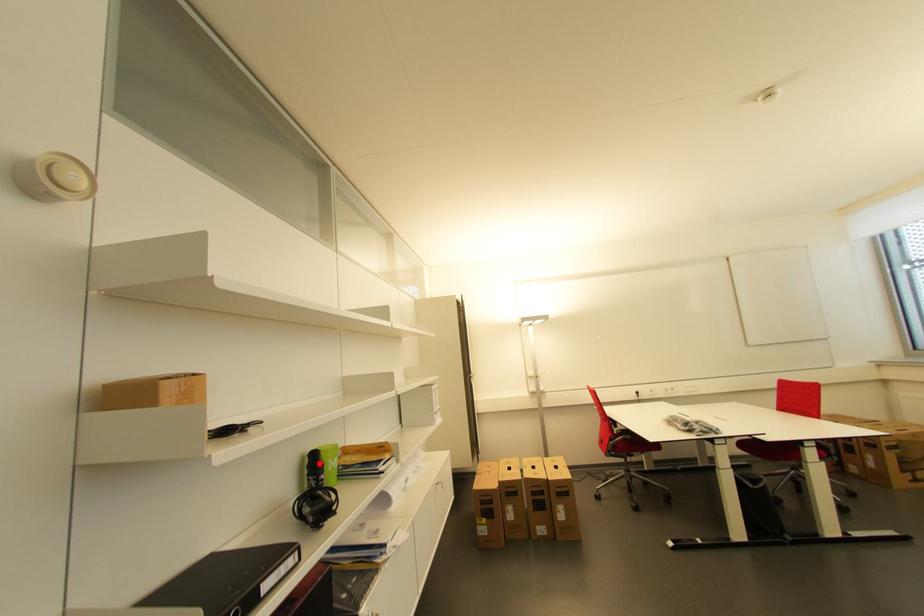
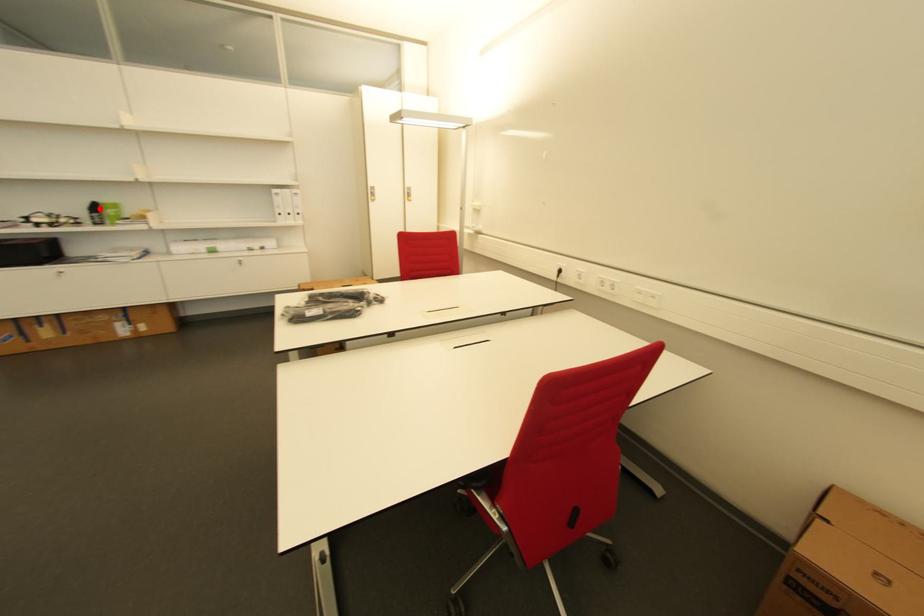
I am providing you with two images of the same scene from different viewpoints. A red point is marked on the first image and another point is marked on the second image. Do the highlighted points in image1 and image2 indicate the same real-world spot?

Yes